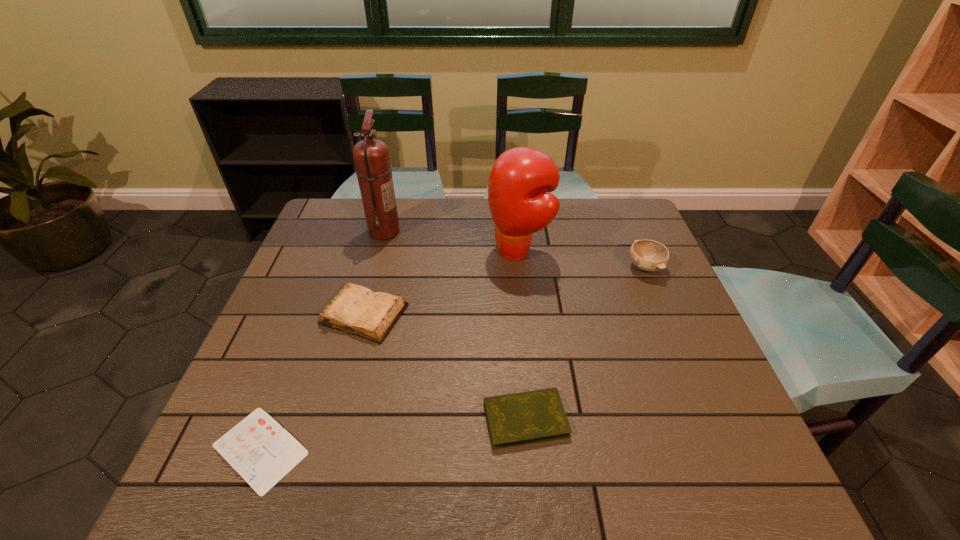
Select which diary is the closest to the boxing glove. Please provide its 2D coordinates. Your answer should be formatted as a tuple, i.e. [(x, y)], where the tuple contains the x and y coordinates of a point satisfying the conditions above.

[(357, 310)]

Identify which diary is located as the third nearest to the rightmost object. Please provide its 2D coordinates. Your answer should be formatted as a tuple, i.e. [(x, y)], where the tuple contains the x and y coordinates of a point satisfying the conditions above.

[(262, 452)]

At what (x,y) coordinates should I click in order to perform the action: click on free point that satisfies the following two spatial constraints: 1. on the back side of the farthest diary; 2. on the left side of the shortest object. Please return your answer as a coordinate pair (x, y). Image resolution: width=960 pixels, height=540 pixels. Looking at the image, I should click on (312, 314).